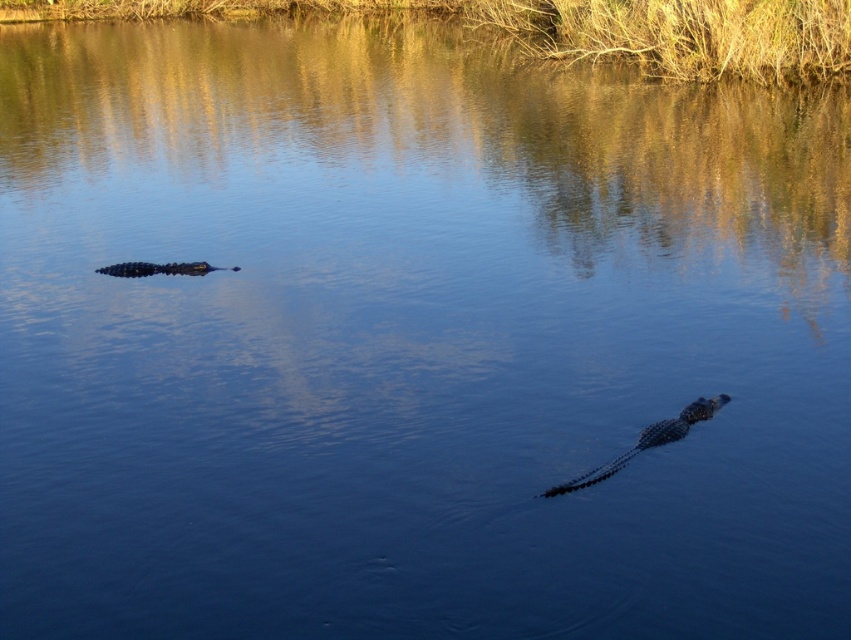
Question: Which point appears farthest from the camera in this image?

Choices:
 (A) (711, 416)
 (B) (198, 260)

Answer: (B)

Question: Is shiny dark green crocodile at center above shiny black crocodile at left?

Choices:
 (A) yes
 (B) no

Answer: (B)

Question: Which of the following is the closest to the observer?

Choices:
 (A) (136, 268)
 (B) (672, 428)

Answer: (B)

Question: Does shiny dark green crocodile at center have a larger size compared to shiny black crocodile at left?

Choices:
 (A) yes
 (B) no

Answer: (A)

Question: Does shiny dark green crocodile at center appear under shiny black crocodile at left?

Choices:
 (A) yes
 (B) no

Answer: (A)